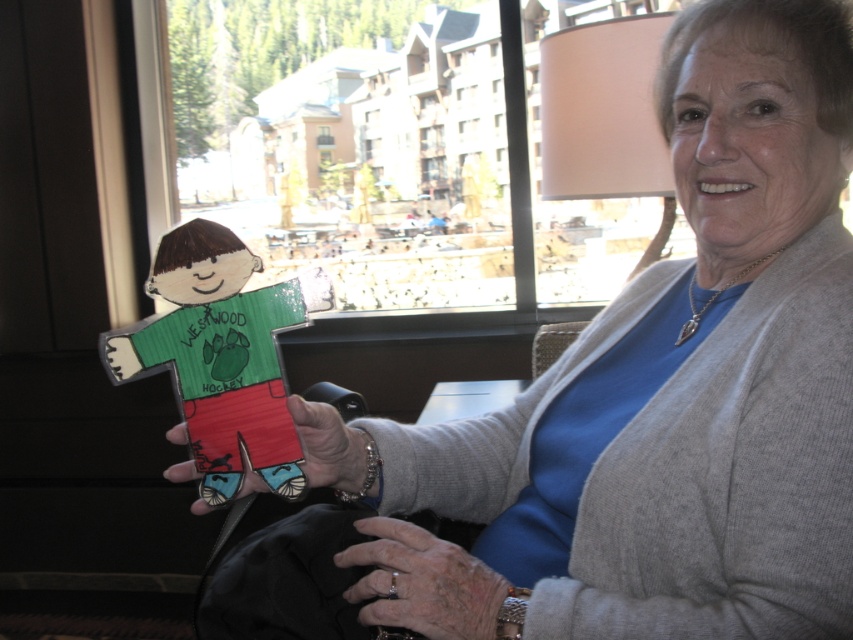
You are an interior designer assessing the space in the image. You need to determine if the cardboard figure at center and the silver metallic ring at lower center can both fit on a shelf that can hold items up to 10 inches in height. Given their size relationship, what is your conclusion?

The cardboard figure at center is larger in size than the silver metallic ring at lower center. Since the shelf can hold items up to 10 inches in height, if the cardboard figure at center is within this limit, both items can fit. However, if the cardboard figure exceeds 10 inches, neither will fit. The exact sizes aren

You are an interior designer planning to place a decorative item on a shelf. You have the silver metallic ring at lower center and the matte cardboard figure at center. Which object would you choose if you want something smaller to fit into a narrow shelf space?

The silver metallic ring at lower center has a smaller size compared to the matte cardboard figure at center, so it would be the better choice for fitting into a narrow shelf space.